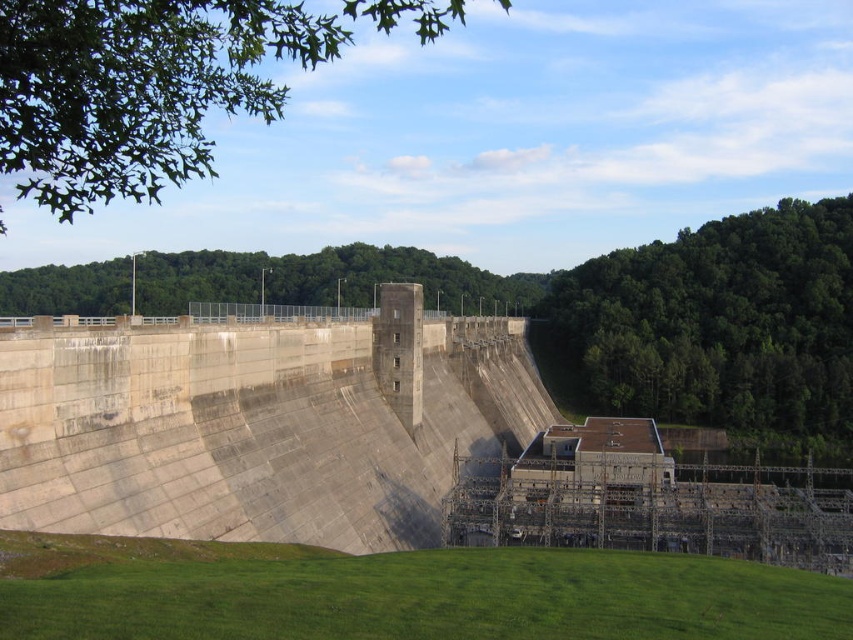
Question: Among these points, which one is farthest from the camera?

Choices:
 (A) (428, 300)
 (B) (167, 48)
 (C) (604, 292)
 (D) (517, 385)

Answer: (A)

Question: Can you confirm if gray concrete dam at center is positioned to the left of green leafy trees at upper center?

Choices:
 (A) yes
 (B) no

Answer: (B)

Question: Does green leafy tree at right have a lesser width compared to green leafy trees at upper center?

Choices:
 (A) yes
 (B) no

Answer: (A)

Question: Which point is closer to the camera?

Choices:
 (A) (271, 273)
 (B) (12, 58)
 (C) (398, 465)
 (D) (598, 324)

Answer: (B)

Question: Is gray concrete dam at center closer to camera compared to green leafy tree at upper left?

Choices:
 (A) yes
 (B) no

Answer: (B)

Question: Which point is farther from the camera taking this photo?

Choices:
 (A) (430, 307)
 (B) (3, 35)
 (C) (338, 330)
 (D) (809, 352)

Answer: (A)